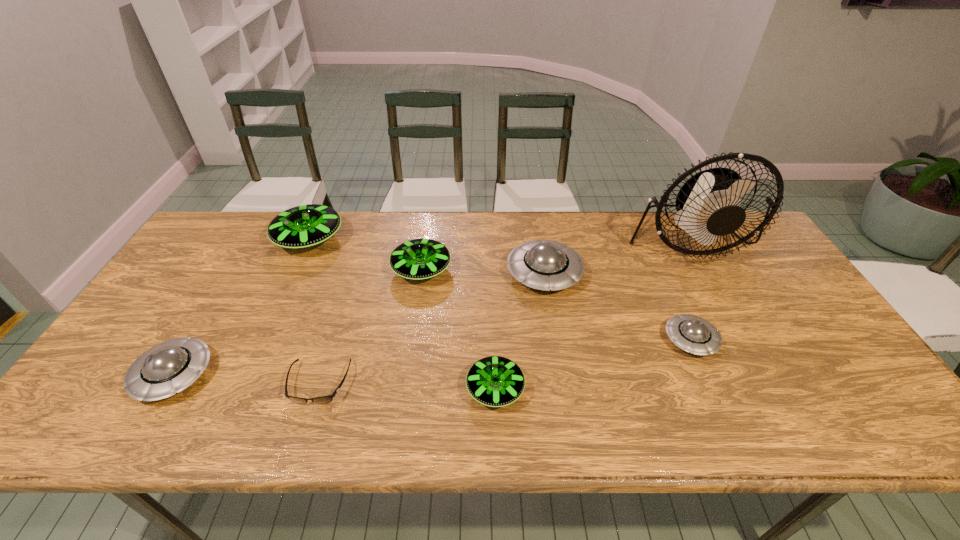
The height and width of the screenshot is (540, 960). I want to click on the tallest object, so click(708, 204).

The height and width of the screenshot is (540, 960). I want to click on fan, so click(x=708, y=204).

The height and width of the screenshot is (540, 960). In order to click on the biggest green saucer in this screenshot , I will do `click(304, 226)`.

This screenshot has height=540, width=960. Find the location of `the biggest gray saucer`. the biggest gray saucer is located at coordinates (546, 265).

The width and height of the screenshot is (960, 540). Find the location of `the farthest gray saucer`. the farthest gray saucer is located at coordinates (546, 265).

What are the coordinates of `the second green saucer from left to right` in the screenshot? It's located at (418, 259).

The width and height of the screenshot is (960, 540). Identify the location of the fourth saucer from right to left. point(418,259).

You are a GUI agent. You are given a task and a screenshot of the screen. Output one action in this format:
    pyautogui.click(x=<x>, y=<y>)
    Task: Click on the second biggest gray saucer
    The image size is (960, 540).
    Given the screenshot: What is the action you would take?
    [168, 368]

The width and height of the screenshot is (960, 540). What are the coordinates of `the nearest green saucer` in the screenshot? It's located at (495, 381).

This screenshot has height=540, width=960. I want to click on the smallest green saucer, so click(x=495, y=381).